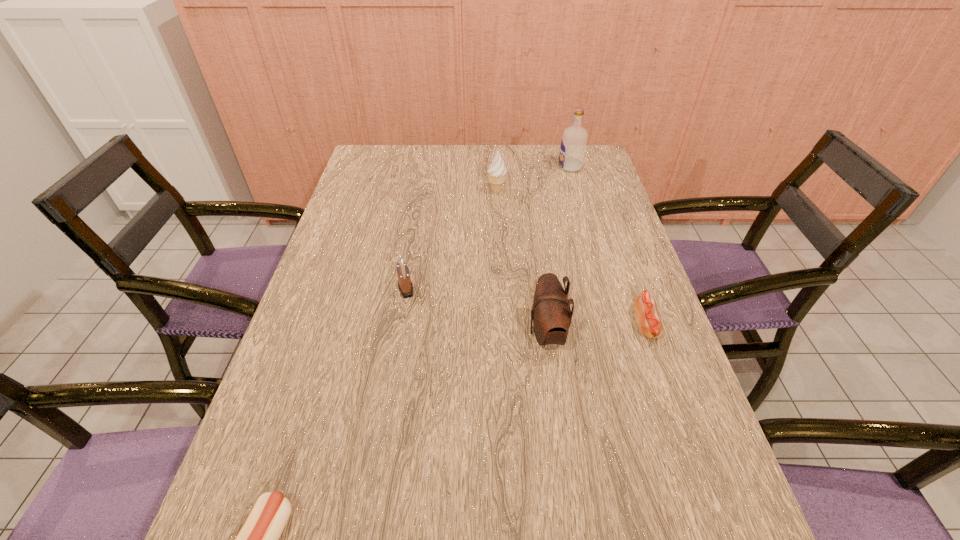
Find the location of a particular element. the tallest object is located at coordinates (573, 144).

At what (x,y) coordinates should I click in order to perform the action: click on the farthest object. Please return your answer as a coordinate pair (x, y). The width and height of the screenshot is (960, 540). Looking at the image, I should click on (573, 144).

At what (x,y) coordinates should I click in order to perform the action: click on icecream. Please return your answer as a coordinate pair (x, y). Image resolution: width=960 pixels, height=540 pixels. Looking at the image, I should click on (497, 170).

Locate an element on the screen. This screenshot has height=540, width=960. the fifth nearest object is located at coordinates click(x=497, y=170).

The height and width of the screenshot is (540, 960). Find the location of `the third object from right to left`. the third object from right to left is located at coordinates (551, 315).

I want to click on the third farthest object, so click(405, 286).

I want to click on padlock, so point(405,286).

This screenshot has width=960, height=540. What are the coordinates of `the farther sausage` in the screenshot? It's located at (650, 325).

Image resolution: width=960 pixels, height=540 pixels. I want to click on the rightmost object, so click(650, 325).

Identify the location of vacant space located 0.320m on the label of the vodka. The image size is (960, 540). (468, 167).